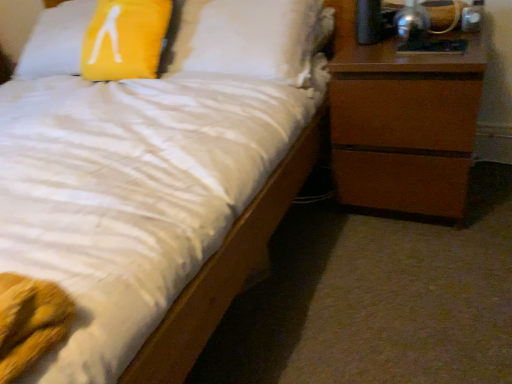
Question: Based on their sizes in the image, would you say brown wood chest of drawers at right is bigger or smaller than yellow fabric pillow at upper left?

Choices:
 (A) big
 (B) small

Answer: (B)

Question: In terms of height, does brown wood chest of drawers at right look taller or shorter compared to yellow fabric pillow at upper left?

Choices:
 (A) short
 (B) tall

Answer: (B)

Question: Considering the real-world distances, which object is farthest from the metallic silver lamp at upper right?

Choices:
 (A) brown wood chest of drawers at right
 (B) yellow fabric pillow at upper left

Answer: (B)

Question: Estimate the real-world distances between objects in this image. Which object is closer to the yellow fabric pillow at upper left?

Choices:
 (A) brown wood chest of drawers at right
 (B) metallic silver lamp at upper right

Answer: (A)